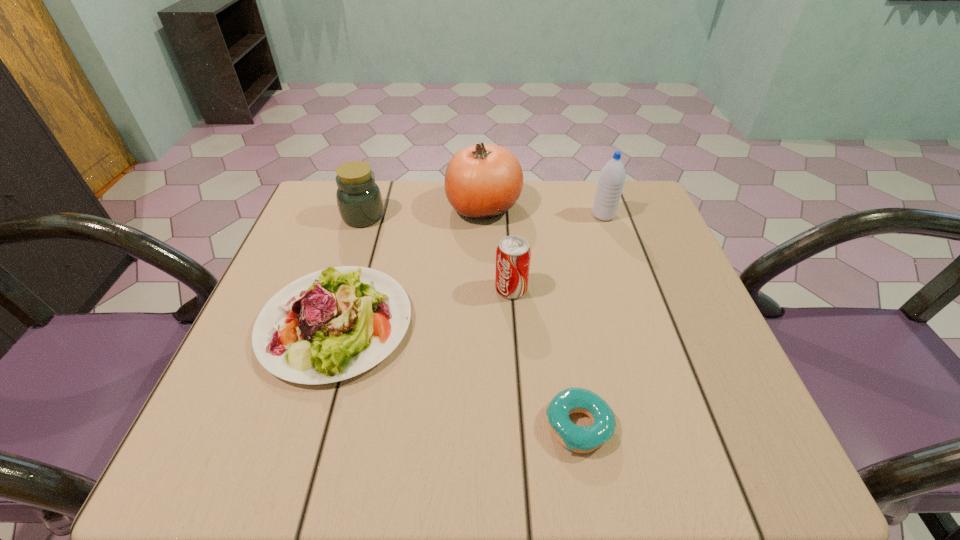
At what (x,y) coordinates should I click in order to perform the action: click on pumpkin. Please return your answer as a coordinate pair (x, y). Image resolution: width=960 pixels, height=540 pixels. Looking at the image, I should click on (482, 181).

Where is `water bottle`? This screenshot has width=960, height=540. water bottle is located at coordinates (611, 180).

What are the coordinates of `jar` in the screenshot? It's located at (359, 200).

Locate an element on the screen. soda can is located at coordinates (513, 253).

Locate an element on the screen. This screenshot has height=540, width=960. the second shortest object is located at coordinates (333, 324).

Find the location of a particular element. Image resolution: width=960 pixels, height=540 pixels. the shortest object is located at coordinates (580, 439).

Find the location of `the nearest object`. the nearest object is located at coordinates (580, 439).

The width and height of the screenshot is (960, 540). What are the coordinates of `vacant space located on the front of the pumpkin` in the screenshot? It's located at (486, 348).

Identify the location of blank space located on the left of the water bottle. Image resolution: width=960 pixels, height=540 pixels. (512, 215).

Image resolution: width=960 pixels, height=540 pixels. Find the location of `vacant space located 0.260m on the right of the jar`. vacant space located 0.260m on the right of the jar is located at coordinates (484, 217).